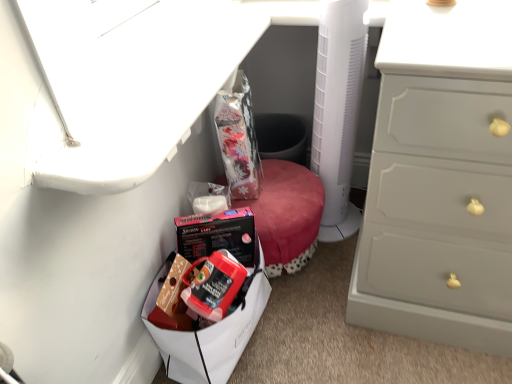
Question: Should I look upward or downward to see matte plastic lunch box at lower left?

Choices:
 (A) up
 (B) down

Answer: (B)

Question: Is white plastic fan at center not near matte black box at lower center?

Choices:
 (A) no
 (B) yes

Answer: (A)

Question: Does white plastic fan at center have a greater height compared to matte black box at lower center?

Choices:
 (A) no
 (B) yes

Answer: (B)

Question: Does white plastic fan at center lie in front of matte black box at lower center?

Choices:
 (A) no
 (B) yes

Answer: (B)

Question: Is white plastic fan at center thinner than matte black box at lower center?

Choices:
 (A) yes
 (B) no

Answer: (A)

Question: Is white plastic fan at center to the left of matte black box at lower center from the viewer's perspective?

Choices:
 (A) no
 (B) yes

Answer: (A)

Question: Is white plastic fan at center smaller than matte black box at lower center?

Choices:
 (A) yes
 (B) no

Answer: (A)

Question: Can you confirm if matte plastic lunch box at lower left is shorter than metallic silver vanity at upper left?

Choices:
 (A) no
 (B) yes

Answer: (A)

Question: From a real-world perspective, does matte plastic lunch box at lower left stand above metallic silver vanity at upper left?

Choices:
 (A) yes
 (B) no

Answer: (B)

Question: Could you tell me if matte plastic lunch box at lower left is facing metallic silver vanity at upper left?

Choices:
 (A) no
 (B) yes

Answer: (A)

Question: Is matte plastic lunch box at lower left completely or partially outside of metallic silver vanity at upper left?

Choices:
 (A) yes
 (B) no

Answer: (A)

Question: From a real-world perspective, is matte plastic lunch box at lower left under metallic silver vanity at upper left?

Choices:
 (A) yes
 (B) no

Answer: (A)

Question: Considering the relative positions of matte plastic lunch box at lower left and metallic silver vanity at upper left in the image provided, is matte plastic lunch box at lower left in front of metallic silver vanity at upper left?

Choices:
 (A) no
 (B) yes

Answer: (A)

Question: Can you confirm if white plastic fan at center is positioned to the right of metallic silver vanity at upper left?

Choices:
 (A) yes
 (B) no

Answer: (A)